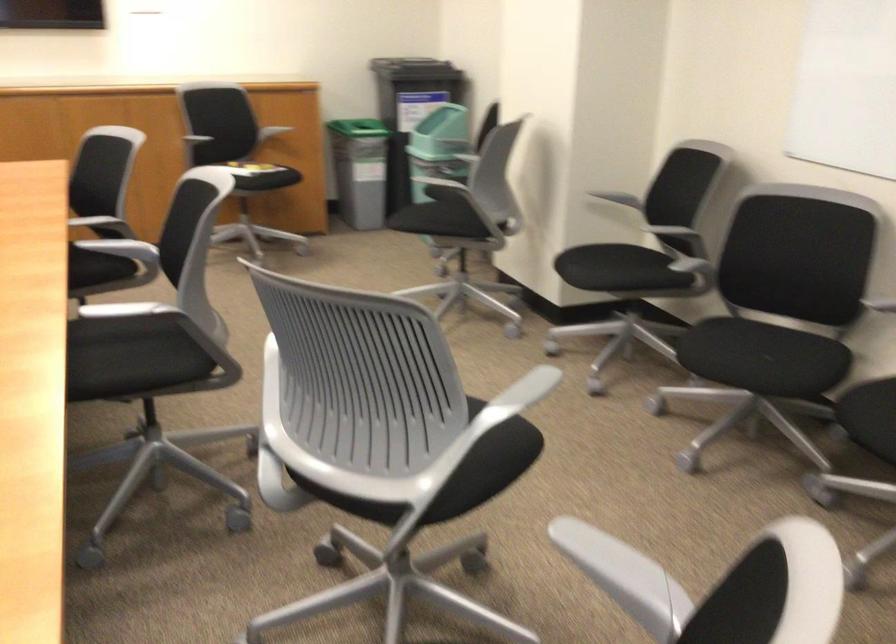
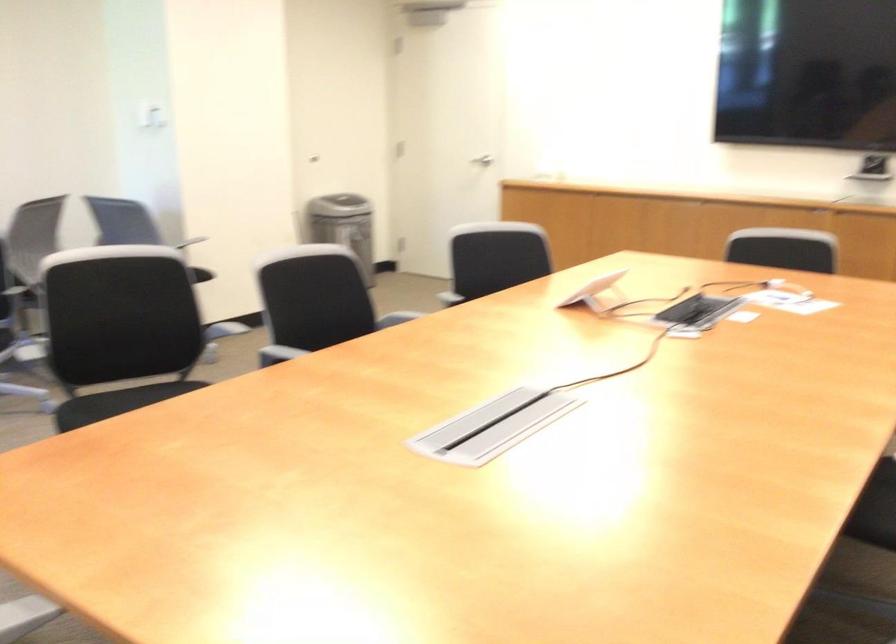
Question: The camera is either moving clockwise (left) or counter-clockwise (right) around the object. The first image is from the beginning of the video and the second image is from the end. Is the camera moving left or right when shooting the video?

Choices:
 (A) Left
 (B) Right

Answer: (B)